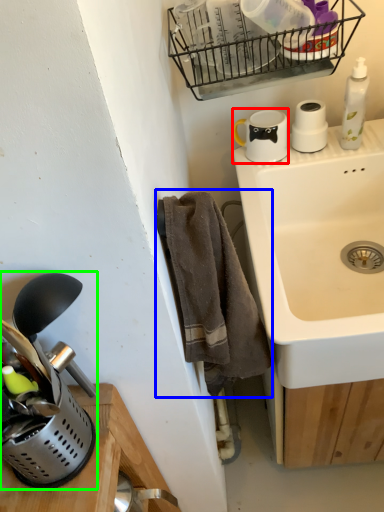
Question: Which object is positioned farthest from appliance (highlighted by a red box)? Select from bath towel (highlighted by a blue box) and appliance (highlighted by a green box).

Choices:
 (A) bath towel
 (B) appliance

Answer: (B)